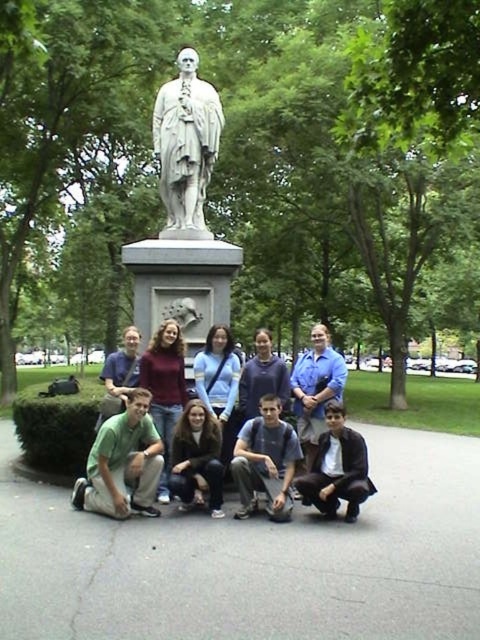
Question: Which object appears farthest from the camera in this image?

Choices:
 (A) blue denim jeans at center
 (B) white marble statue at center
 (C) dark brown hair at center

Answer: (B)

Question: Is white marble statue at center further to the viewer compared to blue denim jeans at center?

Choices:
 (A) no
 (B) yes

Answer: (B)

Question: Can you confirm if white marble statue at center is positioned above dark blue shirt at center?

Choices:
 (A) no
 (B) yes

Answer: (B)

Question: Which is nearer to the white marble statue at center?

Choices:
 (A) dark blue shirt at center
 (B) matte blue shirt at center
 (C) dark brown hair at center

Answer: (B)

Question: Which point appears farthest from the camera in this image?

Choices:
 (A) (104, 508)
 (B) (172, 154)
 (C) (346, 454)

Answer: (B)

Question: Does dark blue shirt at center have a greater width compared to dark brown hair at center?

Choices:
 (A) yes
 (B) no

Answer: (A)